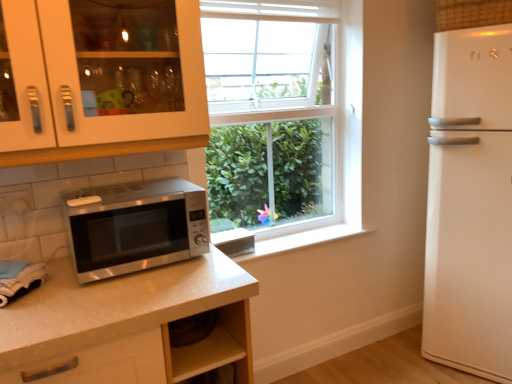
In order to face satin silver microwave at lower left, should I rotate leftwards or rightwards?

Turn left approximately 16.159 degrees to face it.

Measure the distance between white glossy cabinet at upper left and camera.

The distance of white glossy cabinet at upper left from camera is 3.96 feet.

Locate an element on the screen. satin silver microwave at lower left is located at coordinates (136, 226).

Can you tell me how much white glossy cabinet at upper left and white glossy refrigerator at right differ in facing direction?

The facing directions of white glossy cabinet at upper left and white glossy refrigerator at right are 65.2 degrees apart.

In terms of height, does white glossy cabinet at upper left look taller or shorter compared to white glossy refrigerator at right?

Considering their sizes, white glossy cabinet at upper left has less height than white glossy refrigerator at right.

Based on the photo, is white glossy cabinet at upper left next to white glossy refrigerator at right?

No, white glossy cabinet at upper left is not beside white glossy refrigerator at right.

Between point (197, 28) and point (493, 339), which one is positioned in front?

The point (197, 28) is more forward.

From a real-world perspective, is satin silver microwave at lower left over white glossy refrigerator at right?

Yes, from a real-world perspective, satin silver microwave at lower left is on top of white glossy refrigerator at right.

Are satin silver microwave at lower left and white glossy refrigerator at right making contact?

satin silver microwave at lower left and white glossy refrigerator at right are not in contact.

In terms of height, does satin silver microwave at lower left look taller or shorter compared to white glossy refrigerator at right?

Considering their sizes, satin silver microwave at lower left has less height than white glossy refrigerator at right.

Can we say satin silver microwave at lower left lies outside white glossy refrigerator at right?

That's correct, satin silver microwave at lower left is outside of white glossy refrigerator at right.

Which object is positioned more to the right, satin silver microwave at lower left or white glossy cabinet at upper left?

Positioned to the right is satin silver microwave at lower left.

From a real-world perspective, does satin silver microwave at lower left sit lower than white glossy cabinet at upper left?

Yes, from a real-world perspective, satin silver microwave at lower left is below white glossy cabinet at upper left.

Considering the sizes of satin silver microwave at lower left and white glossy cabinet at upper left in the image, is satin silver microwave at lower left taller or shorter than white glossy cabinet at upper left?

Considering their sizes, satin silver microwave at lower left has less height than white glossy cabinet at upper left.

Is white glossy refrigerator at right not near white glossy cabinet at upper left?

white glossy refrigerator at right is positioned a significant distance from white glossy cabinet at upper left.

Considering the sizes of objects white glossy refrigerator at right and white glossy cabinet at upper left in the image provided, who is bigger, white glossy refrigerator at right or white glossy cabinet at upper left?

white glossy refrigerator at right.

Who is shorter, white glossy refrigerator at right or white glossy cabinet at upper left?

Standing shorter between the two is white glossy cabinet at upper left.

I want to click on cabinetry that appears above the white glossy refrigerator at right (from the image's perspective), so click(116, 116).

Does white glossy cabinet at upper left come in front of satin silver microwave at lower left?

Yes, the depth of white glossy cabinet at upper left is less than that of satin silver microwave at lower left.

Is white glossy cabinet at upper left outside of satin silver microwave at lower left?

white glossy cabinet at upper left lies outside satin silver microwave at lower left's area.

From the image's perspective, is white glossy cabinet at upper left on top of satin silver microwave at lower left?

Correct, white glossy cabinet at upper left appears higher than satin silver microwave at lower left in the image.

Does white glossy refrigerator at right lie in front of satin silver microwave at lower left?

No.

The height and width of the screenshot is (384, 512). In order to click on refrigerator located behind the satin silver microwave at lower left in this screenshot , I will do `click(470, 204)`.

Is white glossy refrigerator at right far from satin silver microwave at lower left?

white glossy refrigerator at right is positioned a significant distance from satin silver microwave at lower left.

From the picture: Which object is positioned more to the left, white glossy refrigerator at right or satin silver microwave at lower left?

From the viewer's perspective, satin silver microwave at lower left appears more on the left side.

The height and width of the screenshot is (384, 512). I want to click on cabinetry lying in front of the white glossy refrigerator at right, so click(116, 116).

Where is `refrigerator above the satin silver microwave at lower left (from the image's perspective)`? This screenshot has height=384, width=512. refrigerator above the satin silver microwave at lower left (from the image's perspective) is located at coordinates (470, 204).

Based on their spatial positions, is satin silver microwave at lower left or white glossy refrigerator at right closer to white glossy cabinet at upper left?

Based on the image, satin silver microwave at lower left appears to be nearer to white glossy cabinet at upper left.

Which object lies nearer to the anchor point white glossy refrigerator at right, white glossy cabinet at upper left or satin silver microwave at lower left?

white glossy cabinet at upper left is positioned closer to the anchor white glossy refrigerator at right.

Estimate the real-world distances between objects in this image. Which object is further from satin silver microwave at lower left, white glossy cabinet at upper left or white glossy refrigerator at right?

white glossy refrigerator at right lies further to satin silver microwave at lower left than the other object.

From the image, which object appears to be nearer to satin silver microwave at lower left, white glossy refrigerator at right or white glossy cabinet at upper left?

white glossy cabinet at upper left is closer to satin silver microwave at lower left.

Which object lies further to the anchor point white glossy refrigerator at right, satin silver microwave at lower left or white glossy cabinet at upper left?

satin silver microwave at lower left lies further to white glossy refrigerator at right than the other object.

Which object lies further to the anchor point white glossy cabinet at upper left, white glossy refrigerator at right or satin silver microwave at lower left?

white glossy refrigerator at right.

Identify the location of microwave oven located between white glossy cabinet at upper left and white glossy refrigerator at right in the left-right direction. (136, 226).